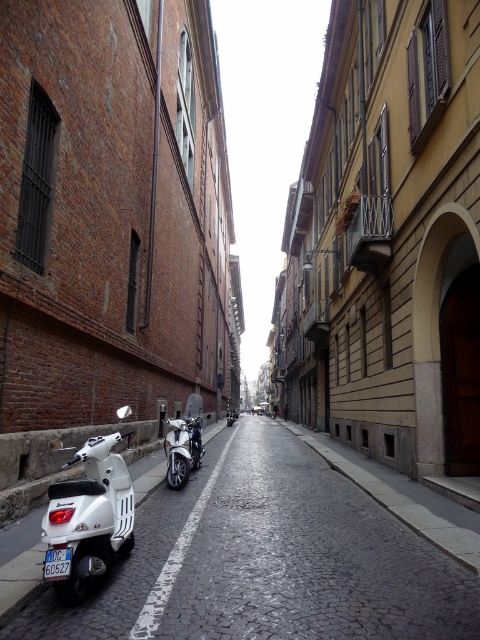
You are a delivery person who needs to park your scooter in this narrow street. You see the white glossy scooter at lower left and the blue plastic license plate at center. Which object takes up more space in the image?

The white glossy scooter at lower left is bigger than the blue plastic license plate at center, so it takes up more space in the image.

You are a delivery person who needs to load a package onto the white matte scooter at lower left. The package requires a surface area larger than the blue plastic license plate at center. Can the scooter accommodate the package?

The white matte scooter at lower left has a larger size compared to the blue plastic license plate at center, so yes, the scooter can accommodate the package since its surface area is bigger than the license plate.